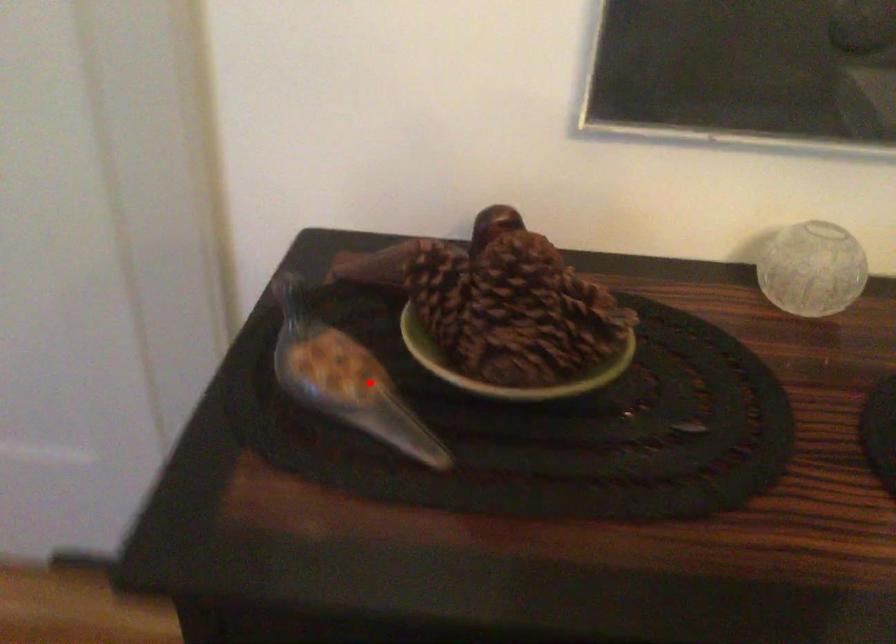
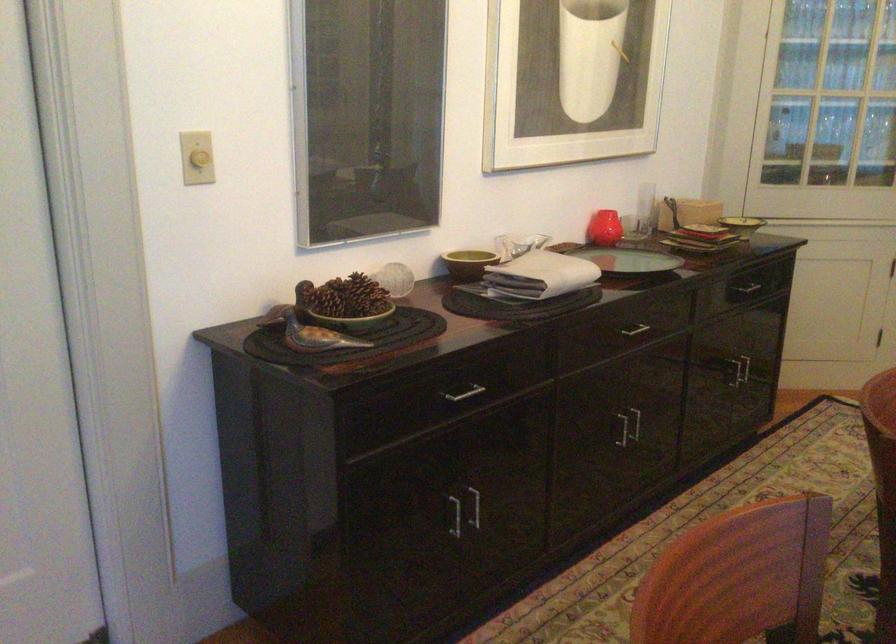
Question: I am providing you with two images of the same scene from different viewpoints. Image1 has a red point marked. In image2, the corresponding 3D location appears at what relative position? Reply with the corresponding letter.

Choices:
 (A) Closer
 (B) Farther

Answer: (B)